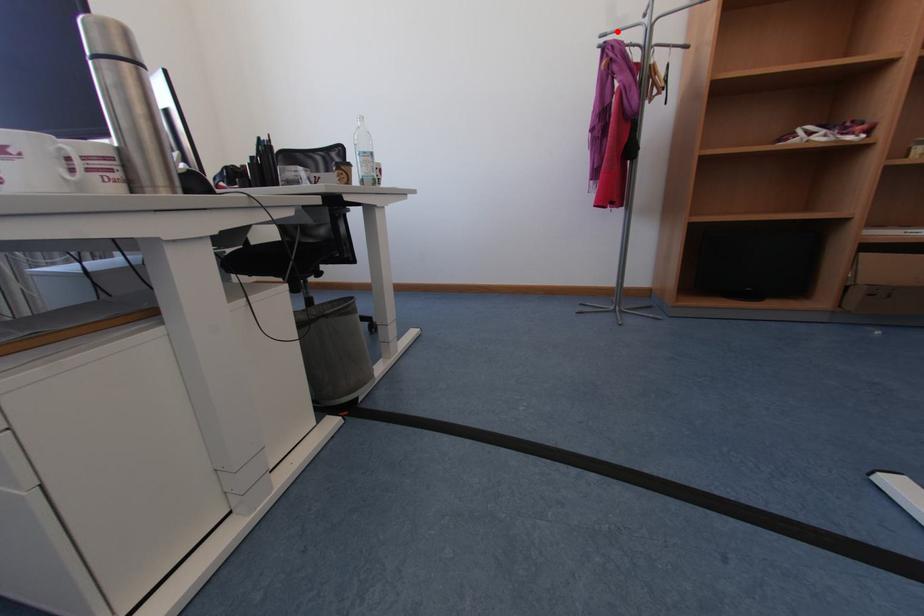
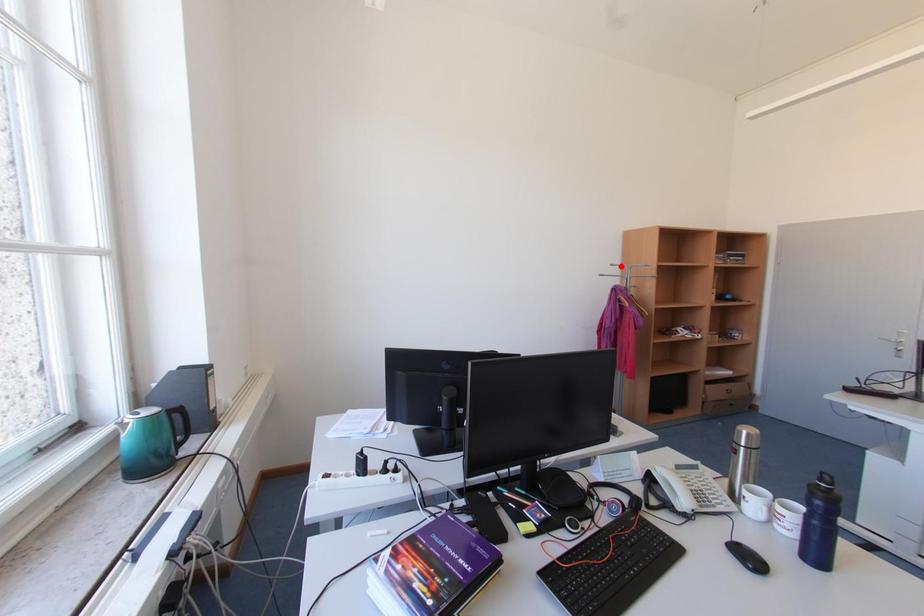
I am providing you with two images of the same scene from different viewpoints. A red point is marked on the first image and another point is marked on the second image. Are the points marked in image1 and image2 representing the same 3D position?

No